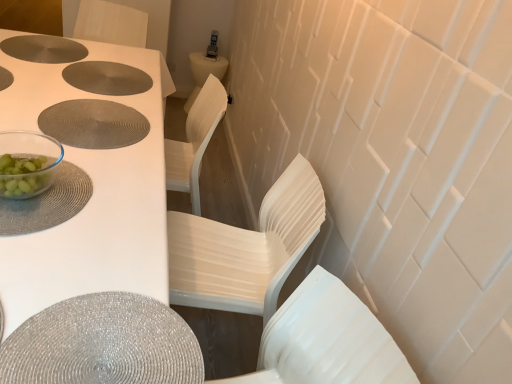
I want to click on empty space that is to the right of green glass bowl at upper left, so click(x=87, y=200).